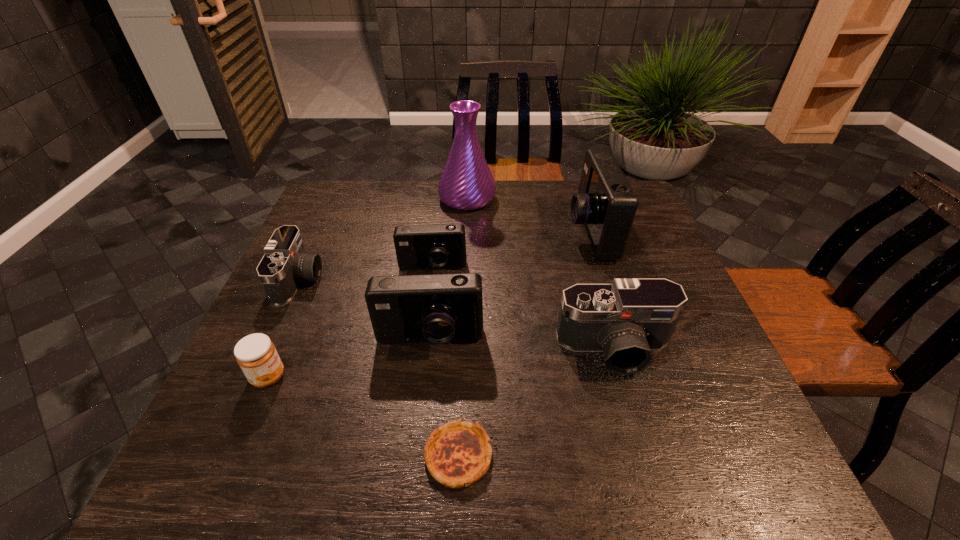
Identify the location of purple vase. (466, 183).

The width and height of the screenshot is (960, 540). Find the location of `the tallest object`. the tallest object is located at coordinates (466, 183).

Find the location of `the second tallest object`. the second tallest object is located at coordinates (605, 204).

In order to click on the rightmost blue camera in this screenshot , I will do `click(605, 204)`.

Where is `the nearest blue camera`? The height and width of the screenshot is (540, 960). the nearest blue camera is located at coordinates (437, 308).

I want to click on the right black camera, so click(628, 319).

Locate an element on the screen. The width and height of the screenshot is (960, 540). the nearer black camera is located at coordinates (628, 319).

Identify the location of the smallest blue camera. This screenshot has height=540, width=960. (438, 246).

Find the location of a particular element. the smaller black camera is located at coordinates (285, 264).

The image size is (960, 540). What are the coordinates of `the leftmost camera` in the screenshot? It's located at (285, 264).